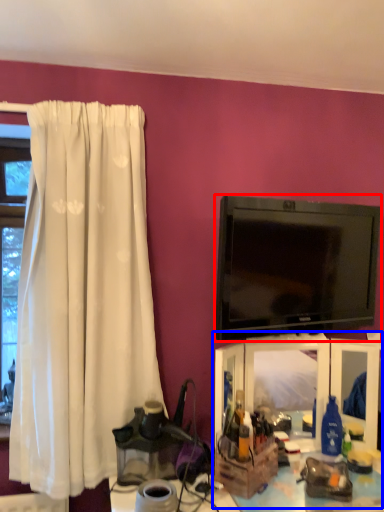
Question: Which object appears closest to the camera in this image, television (highlighted by a red box) or entertainment center (highlighted by a blue box)?

Choices:
 (A) television
 (B) entertainment center

Answer: (A)